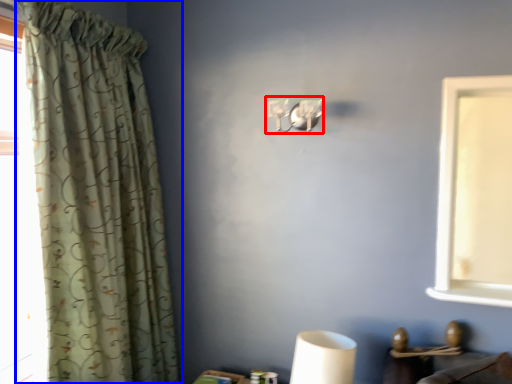
Question: Which point is closer to the camera, lamp (highlighted by a red box) or curtain (highlighted by a blue box)?

Choices:
 (A) lamp
 (B) curtain

Answer: (B)